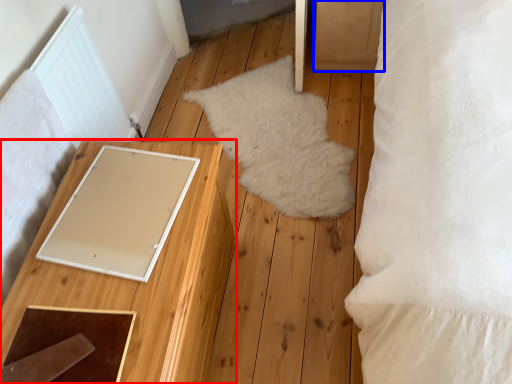
Question: Among these objects, which one is nearest to the camera, furniture (highlighted by a red box) or drawer (highlighted by a blue box)?

Choices:
 (A) furniture
 (B) drawer

Answer: (A)